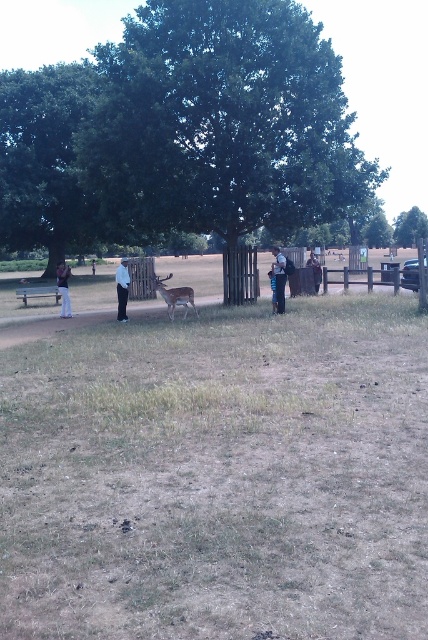
Question: Does green leafy tree at upper center have a lesser width compared to light blue jeans at center?

Choices:
 (A) yes
 (B) no

Answer: (B)

Question: Which point is farther to the camera?

Choices:
 (A) (285, 259)
 (B) (122, 289)
 (C) (62, 401)
 (D) (65, 280)

Answer: (D)

Question: Is green leafy tree at center in front of white fabric shirt at center?

Choices:
 (A) no
 (B) yes

Answer: (B)

Question: Can you confirm if green leafy tree at upper center is smaller than brown velvet deer at center?

Choices:
 (A) no
 (B) yes

Answer: (A)

Question: Based on their relative distances, which object is farther from the light blue jeans at left?

Choices:
 (A) dark blue jeans at center
 (B) green leafy tree at upper center
 (C) brown velvet deer at center

Answer: (B)

Question: Among these objects, which one is farthest from the camera?

Choices:
 (A) white cotton shirt at center
 (B) light blue jeans at left
 (C) brown velvet deer at center

Answer: (B)